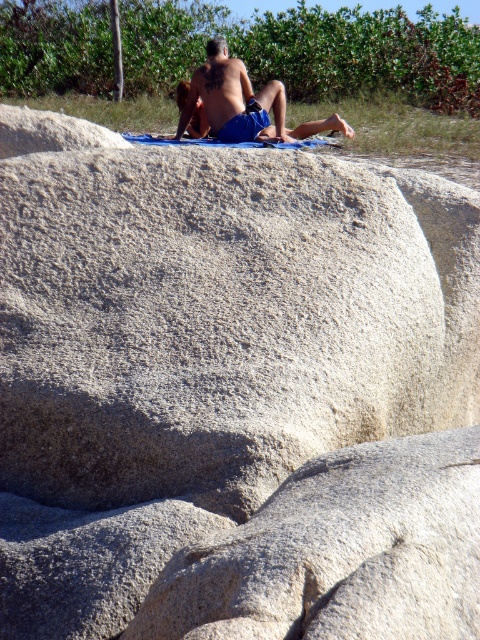
Question: Which point appears closest to the camera in this image?

Choices:
 (A) (391, 515)
 (B) (315, 124)

Answer: (A)

Question: Which point is closer to the camera?

Choices:
 (A) gray rough rock at center
 (B) smooth skin tattooed man at upper center

Answer: (A)

Question: Does gray rough rock at center appear under smooth skin tattooed man at upper center?

Choices:
 (A) yes
 (B) no

Answer: (A)

Question: Is gray rough rock at center further to camera compared to smooth skin tattooed man at upper center?

Choices:
 (A) no
 (B) yes

Answer: (A)

Question: Does gray rough rock at center have a greater width compared to smooth skin tattooed man at upper center?

Choices:
 (A) no
 (B) yes

Answer: (A)

Question: Among these points, which one is farthest from the camera?

Choices:
 (A) (224, 548)
 (B) (215, 108)

Answer: (B)